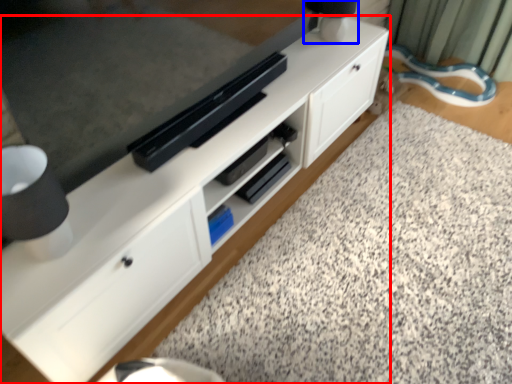
Question: Which object appears farthest to the camera in this image, cabinetry (highlighted by a red box) or table lamp (highlighted by a blue box)?

Choices:
 (A) cabinetry
 (B) table lamp

Answer: (B)